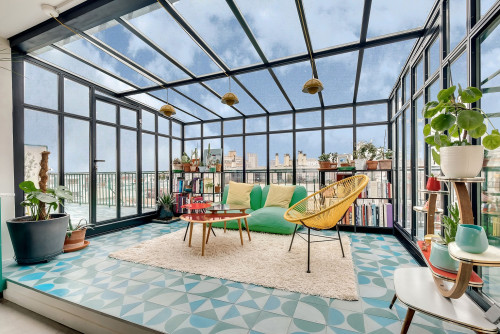
Locate an element on the screen. The image size is (500, 334). table is located at coordinates (214, 216).